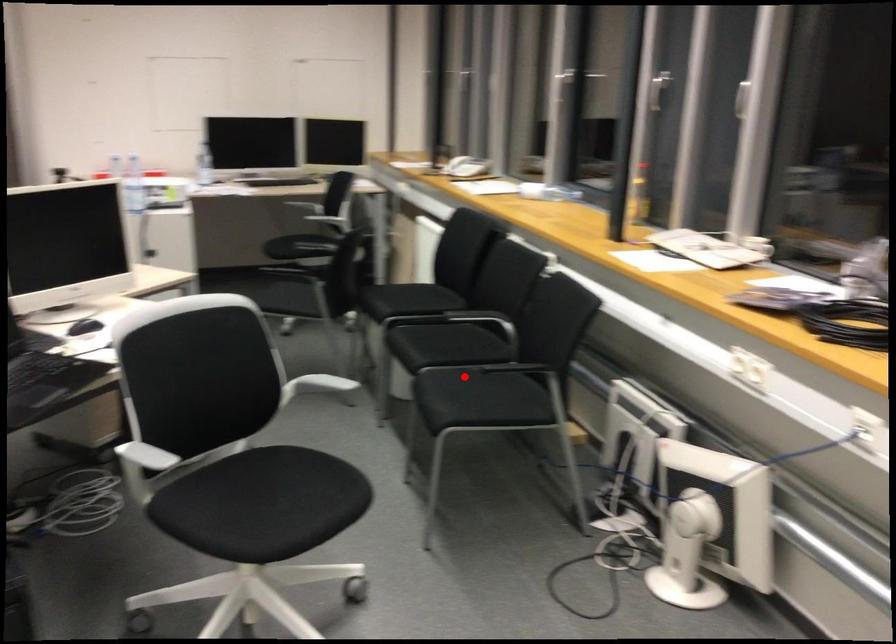
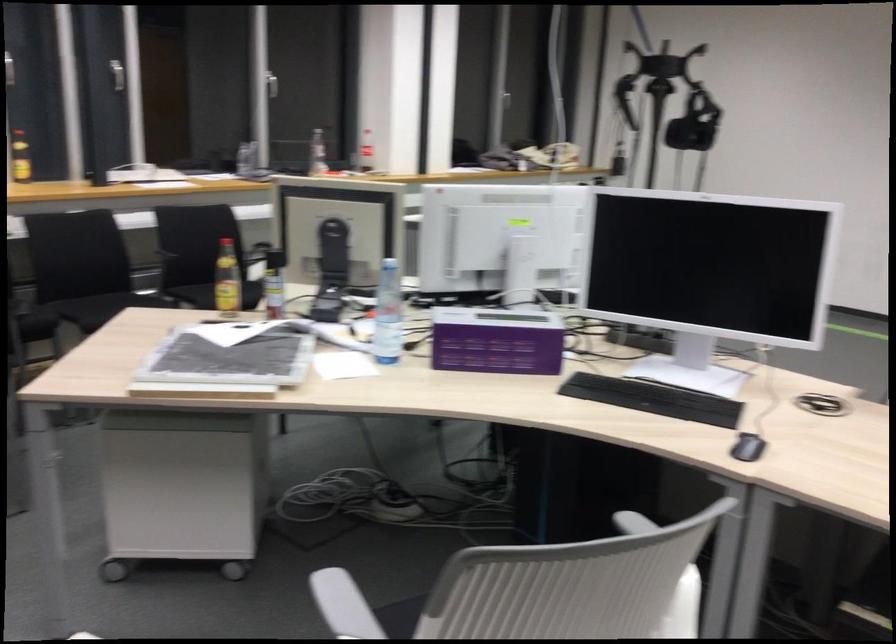
Find the pixel in the second image that matches the highlighted location in the first image.

(192, 295)